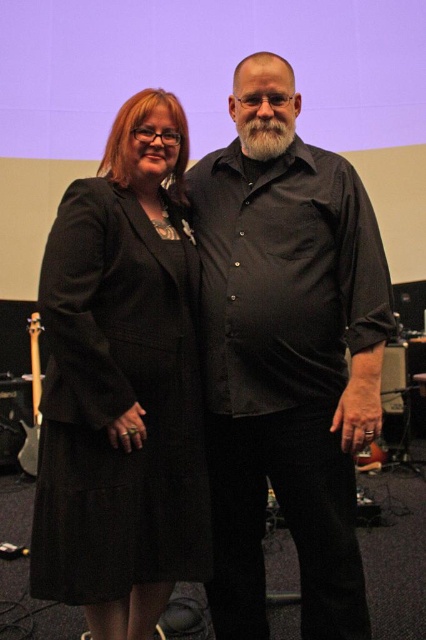
Between matte black shirt at center and matte black dress at left, which one has more height?

matte black shirt at center

Does matte black shirt at center come in front of matte black dress at left?

No.

Which is in front, point (305, 577) or point (127, 448)?

Point (127, 448) is in front.

The width and height of the screenshot is (426, 640). What are the coordinates of `matte black shirt at center` in the screenshot? It's located at (287, 374).

Does white soft beard at center come in front of matte black guitar at lower left?

Yes, it is in front of matte black guitar at lower left.

Is white soft beard at center to the left of matte black guitar at lower left from the viewer's perspective?

No, white soft beard at center is not to the left of matte black guitar at lower left.

Is point (276, 156) closer to viewer compared to point (32, 456)?

Yes.

I want to click on white soft beard at center, so click(264, 136).

Does matte black dress at left have a lesser height compared to matte black guitar at lower left?

No.

Is point (192, 515) farther from camera compared to point (39, 324)?

No, it is in front of (39, 324).

This screenshot has height=640, width=426. In order to click on matte black dress at left in this screenshot , I will do `click(121, 387)`.